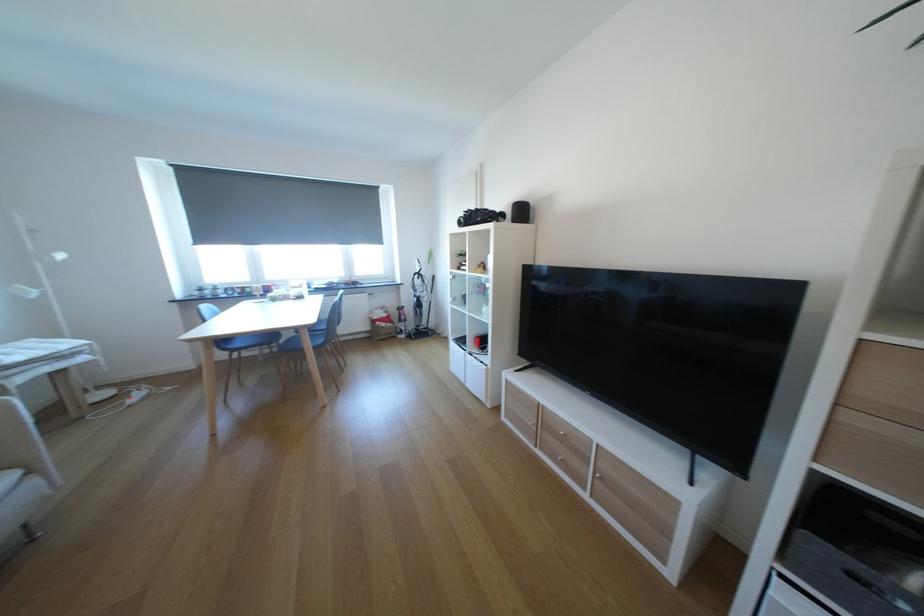
Where is `wooden drawer handle`? wooden drawer handle is located at coordinates (599, 472).